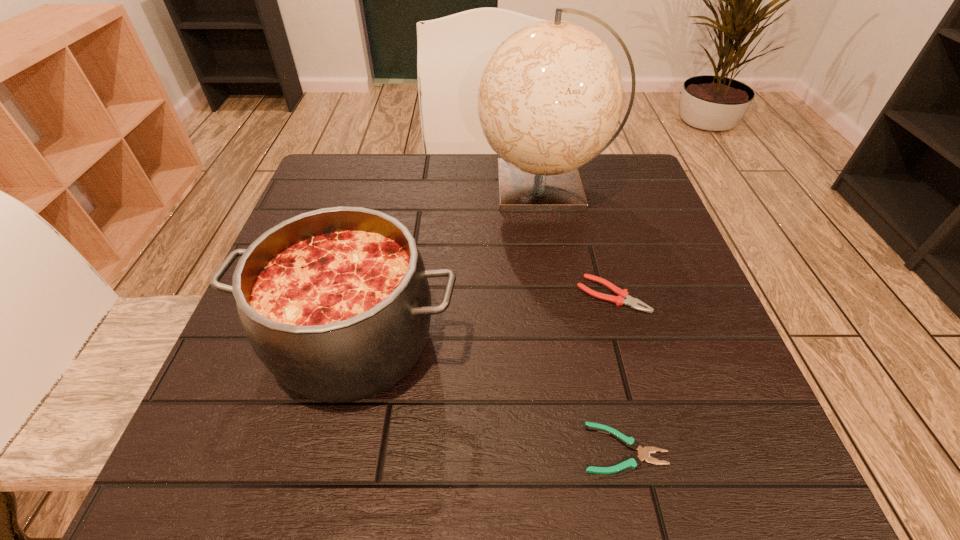
You are a GUI agent. You are given a task and a screenshot of the screen. Output one action in this format:
    pyautogui.click(x=<x>, y=<y>)
    Task: Click on the free space that satisfies the following two spatial constraints: 1. on the surface of the nearer pliers showing Europe and Africa; 2. on the right side of the tallest object
    The width and height of the screenshot is (960, 540).
    Given the screenshot: What is the action you would take?
    pyautogui.click(x=590, y=448)

The height and width of the screenshot is (540, 960). I want to click on free space that satisfies the following two spatial constraints: 1. on the front side of the shortest object; 2. on the right side of the casserole, so click(328, 448).

This screenshot has width=960, height=540. Find the location of `vacant space that satisfies the following two spatial constraints: 1. on the back side of the nearest object; 2. on the surface of the globe showing Europe and Africa`. vacant space that satisfies the following two spatial constraints: 1. on the back side of the nearest object; 2. on the surface of the globe showing Europe and Africa is located at coordinates (564, 187).

Image resolution: width=960 pixels, height=540 pixels. I want to click on free point that satisfies the following two spatial constraints: 1. on the back side of the third tallest object; 2. on the left side of the casserole, so click(x=365, y=295).